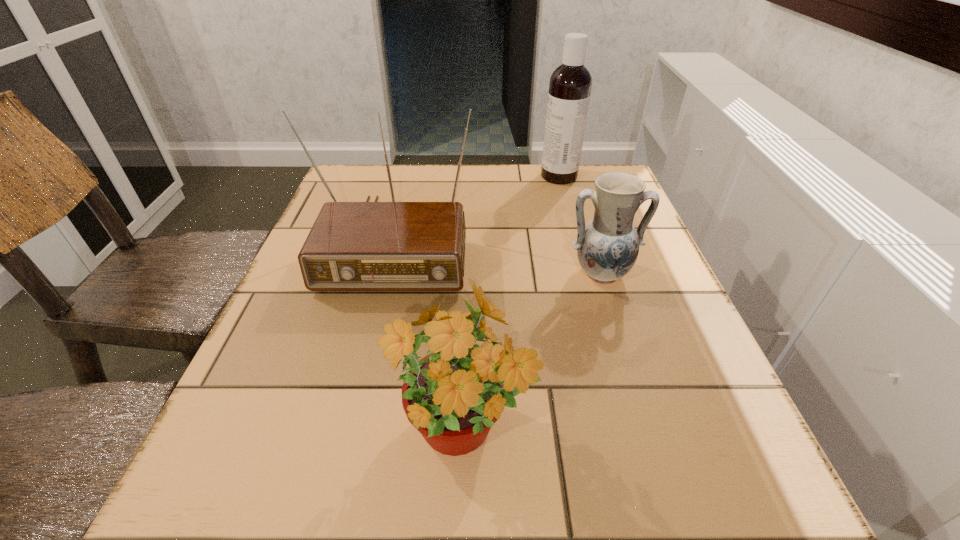
You are a GUI agent. You are given a task and a screenshot of the screen. Output one action in this format:
    pyautogui.click(x=<x>, y=<y>)
    Task: Click on the vacant area that lies between the farthest object and the flowerpot
    
    Given the screenshot: What is the action you would take?
    511,305

Where is `object that is the third closest to the shortest object`? This screenshot has width=960, height=540. object that is the third closest to the shortest object is located at coordinates (570, 84).

Identify which object is the third nearest to the pottery. Please provide its 2D coordinates. Your answer should be formatted as a tuple, i.e. [(x, y)], where the tuple contains the x and y coordinates of a point satisfying the conditions above.

[(570, 84)]

The width and height of the screenshot is (960, 540). What are the coordinates of `free location that satisfies the following two spatial constraints: 1. on the label side of the farthest object; 2. on the front panel of the radio_receiver` in the screenshot? It's located at (577, 240).

Image resolution: width=960 pixels, height=540 pixels. In order to click on vacant region that satisfies the following two spatial constraints: 1. on the front panel of the flowerpot; 2. on the right side of the radio_receiver in this screenshot , I will do `click(347, 435)`.

Image resolution: width=960 pixels, height=540 pixels. I want to click on vacant space that satisfies the following two spatial constraints: 1. on the label side of the tallest object; 2. on the front side of the nearest object, so click(x=631, y=435).

What are the coordinates of `free location that satisfies the following two spatial constraints: 1. on the front panel of the nearest object; 2. on the left side of the radio_receiver` in the screenshot? It's located at (347, 435).

You are a GUI agent. You are given a task and a screenshot of the screen. Output one action in this format:
    pyautogui.click(x=<x>, y=<y>)
    Task: Click on the free location that satisfies the following two spatial constraints: 1. on the label side of the farthest object; 2. on the front panel of the radio_receiver
    This screenshot has width=960, height=540.
    Given the screenshot: What is the action you would take?
    [x=577, y=240]

You are a GUI agent. You are given a task and a screenshot of the screen. Output one action in this format:
    pyautogui.click(x=<x>, y=<y>)
    Task: Click on the vacant position in the image that satisfies the following two spatial constraints: 1. on the label side of the tallest object; 2. on the front panel of the radio_receiver
    
    Given the screenshot: What is the action you would take?
    pyautogui.click(x=577, y=240)

Locate an element on the screen. The width and height of the screenshot is (960, 540). free space that satisfies the following two spatial constraints: 1. on the label side of the dishwasher detergent; 2. on the front side of the flowerpot is located at coordinates (631, 435).